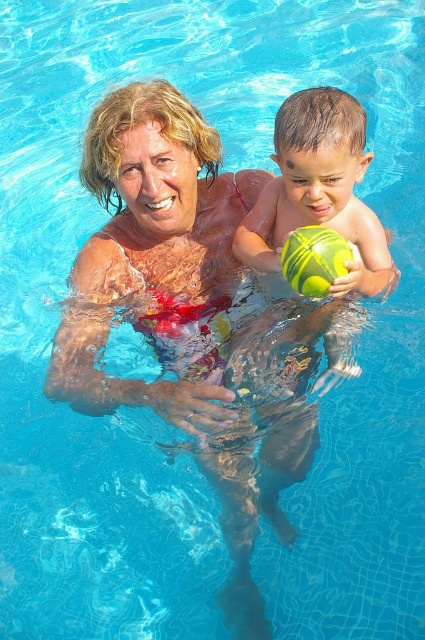
Between green rubber ball at center and yellow-green rubber ball at center, which one appears on the right side from the viewer's perspective?

green rubber ball at center

Is green rubber ball at center shorter than yellow-green rubber ball at center?

In fact, green rubber ball at center may be taller than yellow-green rubber ball at center.

Does point (368, 259) come behind point (288, 266)?

Yes, it is.

Where is `green rubber ball at center`? The height and width of the screenshot is (640, 425). green rubber ball at center is located at coordinates (319, 189).